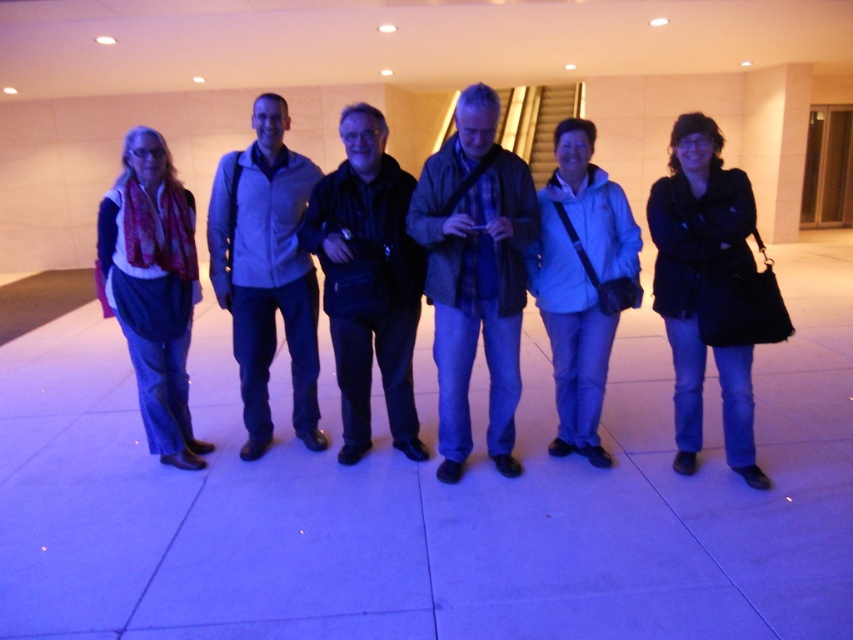
Does blue plaid shirt at center appear on the right side of black leather jacket at center?

In fact, blue plaid shirt at center is to the left of black leather jacket at center.

Who is taller, blue plaid shirt at center or black leather jacket at center?

blue plaid shirt at center is taller.

The width and height of the screenshot is (853, 640). I want to click on blue plaid shirt at center, so click(474, 273).

Who is shorter, black leather jacket at center or white matte jacket at center?

black leather jacket at center

Find the location of a particular element. The width and height of the screenshot is (853, 640). black leather jacket at center is located at coordinates (705, 289).

Between point (572, 132) and point (117, 189), which one is positioned in front?

Point (572, 132) is more forward.

Identify the location of white matte jacket at center. (581, 282).